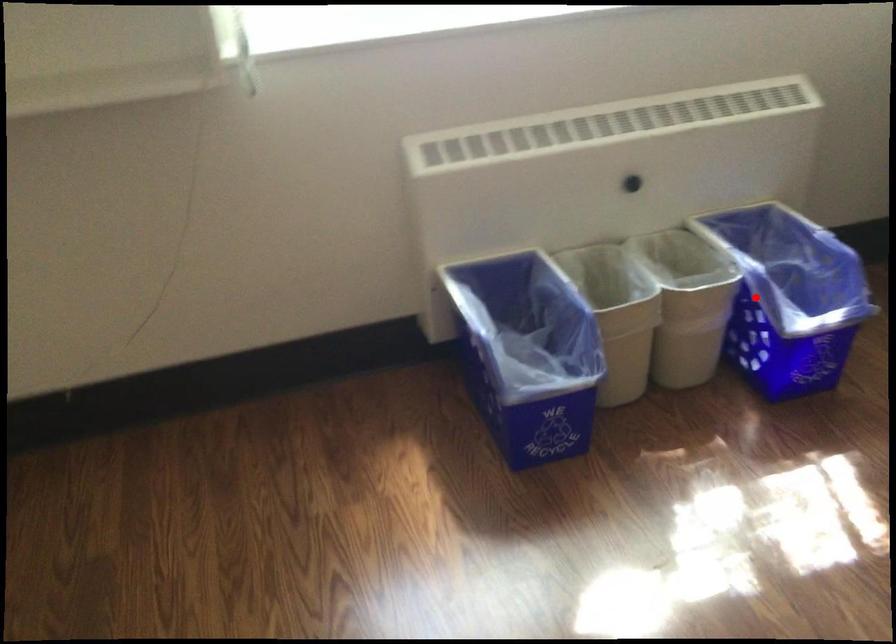
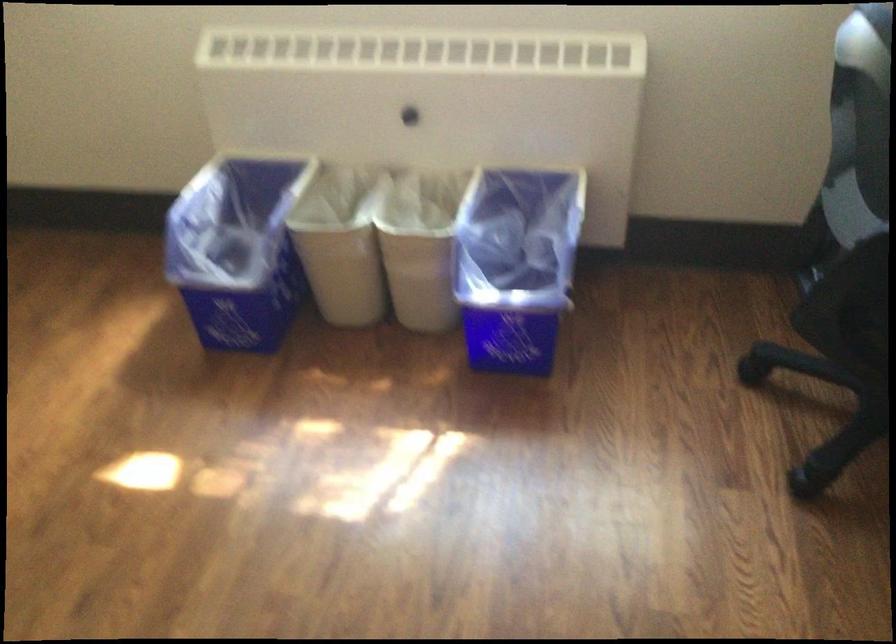
In the second image, find the point that corresponds to the highlighted location in the first image.

(515, 265)